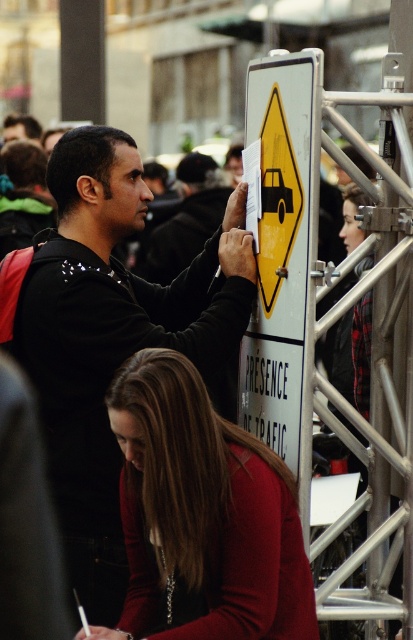
Question: Where is matte red sweater at lower center located in relation to black matte shirt at center in the image?

Choices:
 (A) left
 (B) right

Answer: (B)

Question: Does black matte shirt at upper left appear under matte red sweater at lower center?

Choices:
 (A) no
 (B) yes

Answer: (A)

Question: Which point appears farthest from the camera in this image?

Choices:
 (A) pyautogui.click(x=71, y=417)
 (B) pyautogui.click(x=189, y=563)
 (C) pyautogui.click(x=156, y=237)

Answer: (C)

Question: Among these objects, which one is nearest to the camera?

Choices:
 (A) black matte shirt at upper left
 (B) matte red sweater at lower center
 (C) black matte shirt at center

Answer: (B)

Question: Which of the following is the closest to the observer?

Choices:
 (A) (215, 369)
 (B) (130, 557)

Answer: (B)

Question: Is black matte shirt at upper left positioned at the back of black matte shirt at center?

Choices:
 (A) no
 (B) yes

Answer: (A)